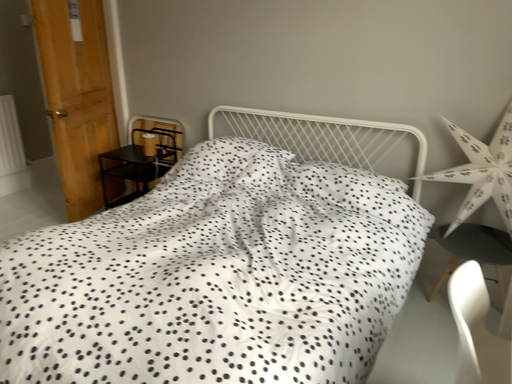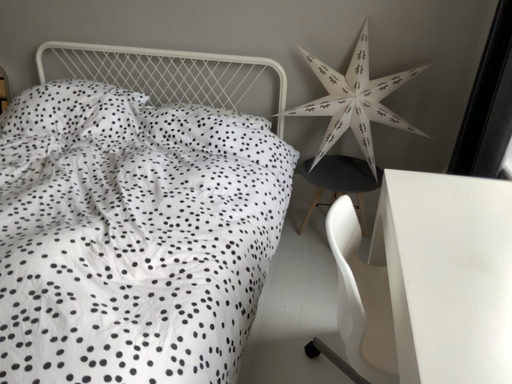
Question: How did the camera likely rotate when shooting the video?

Choices:
 (A) rotated upward
 (B) rotated downward

Answer: (B)